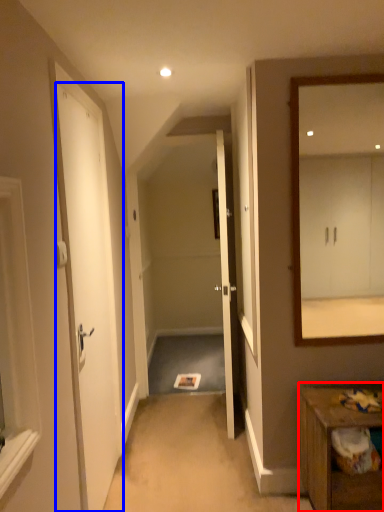
Question: Which of the following is the farthest to the observer, table (highlighted by a red box) or door (highlighted by a blue box)?

Choices:
 (A) table
 (B) door

Answer: (A)